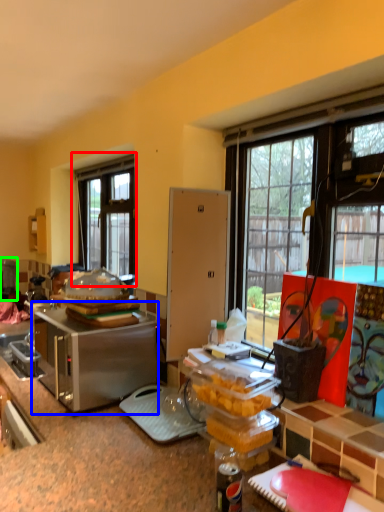
Question: Estimate the real-world distances between objects in this image. Which object is closer to window (highlighted by a red box), appliance (highlighted by a blue box) or appliance (highlighted by a green box)?

Choices:
 (A) appliance
 (B) appliance

Answer: (B)